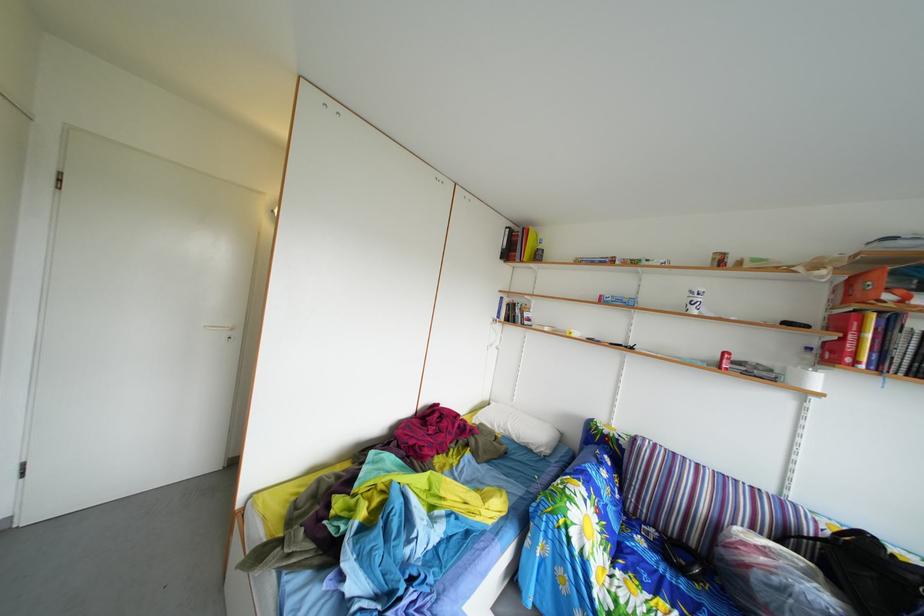
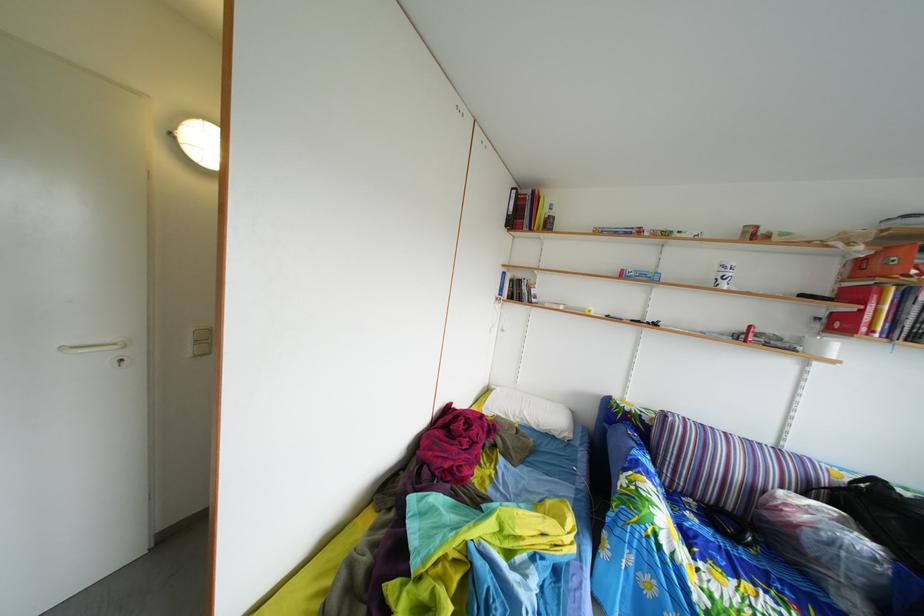
Where in the second image is the point corresponding to point (869, 573) from the first image?

(886, 515)